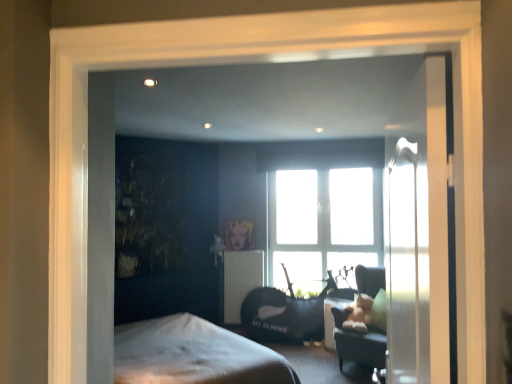
Question: Does velvet black swivel chair at center, the second swivel chair viewed from the front, lie behind velvet dark gray swivel chair at center, positioned as the second swivel chair in back-to-front order?

Choices:
 (A) yes
 (B) no

Answer: (A)

Question: Is velvet black swivel chair at center, acting as the 1th swivel chair starting from the back, not close to velvet dark gray swivel chair at center, positioned as the second swivel chair in back-to-front order?

Choices:
 (A) yes
 (B) no

Answer: (B)

Question: Considering the relative positions of velvet black swivel chair at center, acting as the 1th swivel chair starting from the back, and velvet dark gray swivel chair at center, which ranks as the first swivel chair in front-to-back order, in the image provided, is velvet black swivel chair at center, acting as the 1th swivel chair starting from the back, to the right of velvet dark gray swivel chair at center, which ranks as the first swivel chair in front-to-back order, from the viewer's perspective?

Choices:
 (A) yes
 (B) no

Answer: (B)

Question: Can you confirm if velvet black swivel chair at center, acting as the 1th swivel chair starting from the back, is wider than velvet dark gray swivel chair at center, positioned as the second swivel chair in back-to-front order?

Choices:
 (A) no
 (B) yes

Answer: (A)

Question: Is velvet black swivel chair at center, acting as the 1th swivel chair starting from the back, not within velvet dark gray swivel chair at center, positioned as the second swivel chair in back-to-front order?

Choices:
 (A) yes
 (B) no

Answer: (A)

Question: Is matte black table at lower center taller or shorter than velvet black swivel chair at center, acting as the 1th swivel chair starting from the back?

Choices:
 (A) tall
 (B) short

Answer: (B)

Question: Considering the positions of point pos(325,332) and point pos(297,317), is point pos(325,332) closer or farther from the camera than point pos(297,317)?

Choices:
 (A) farther
 (B) closer

Answer: (B)

Question: Do you think matte black table at lower center is within velvet black swivel chair at center, acting as the 1th swivel chair starting from the back, or outside of it?

Choices:
 (A) outside
 (B) inside

Answer: (A)

Question: From the image's perspective, relative to velvet black swivel chair at center, the second swivel chair viewed from the front, is matte black table at lower center above or below?

Choices:
 (A) above
 (B) below

Answer: (B)

Question: Considering the positions of matte black table at lower center and metallic gold picture frame at center in the image, is matte black table at lower center bigger or smaller than metallic gold picture frame at center?

Choices:
 (A) big
 (B) small

Answer: (A)

Question: Visually, is matte black table at lower center positioned to the left or to the right of metallic gold picture frame at center?

Choices:
 (A) left
 (B) right

Answer: (B)

Question: Relative to metallic gold picture frame at center, is matte black table at lower center in front or behind?

Choices:
 (A) behind
 (B) front

Answer: (B)

Question: Is matte black table at lower center wider or thinner than metallic gold picture frame at center?

Choices:
 (A) thin
 (B) wide

Answer: (B)

Question: Would you say velvet dark gray swivel chair at center, which ranks as the first swivel chair in front-to-back order, is inside or outside clear glass door at right?

Choices:
 (A) inside
 (B) outside

Answer: (B)

Question: From a real-world perspective, is velvet dark gray swivel chair at center, positioned as the second swivel chair in back-to-front order, physically located above or below clear glass door at right?

Choices:
 (A) above
 (B) below

Answer: (B)